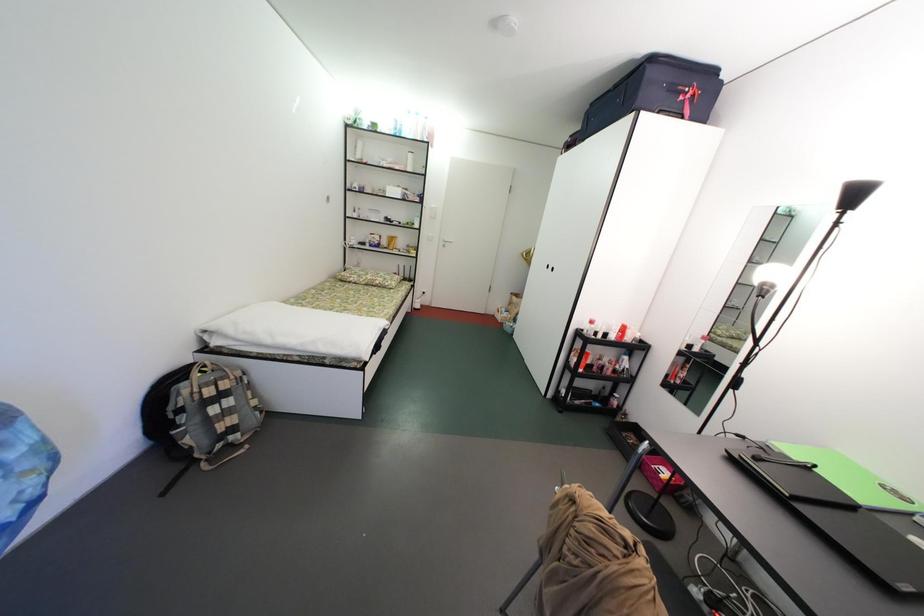
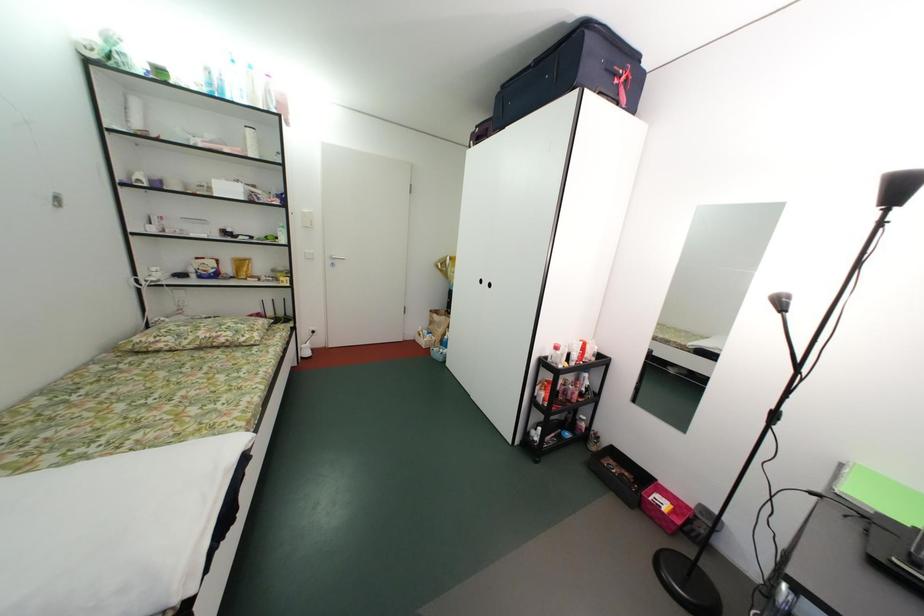
Question: The camera is either moving clockwise (left) or counter-clockwise (right) around the object. The first image is from the beginning of the video and the second image is from the end. Is the camera moving left or right when shooting the video?

Choices:
 (A) Left
 (B) Right

Answer: (A)